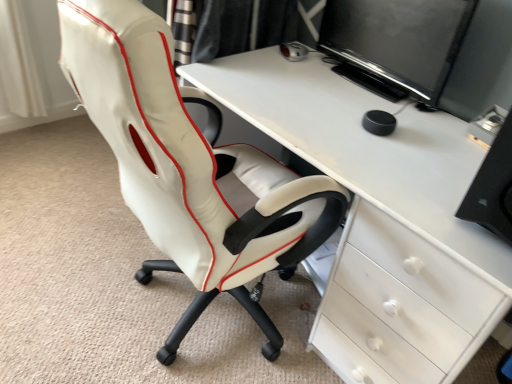
Find the location of a particular element. vacant space behind black plastic computer tower at right is located at coordinates (446, 147).